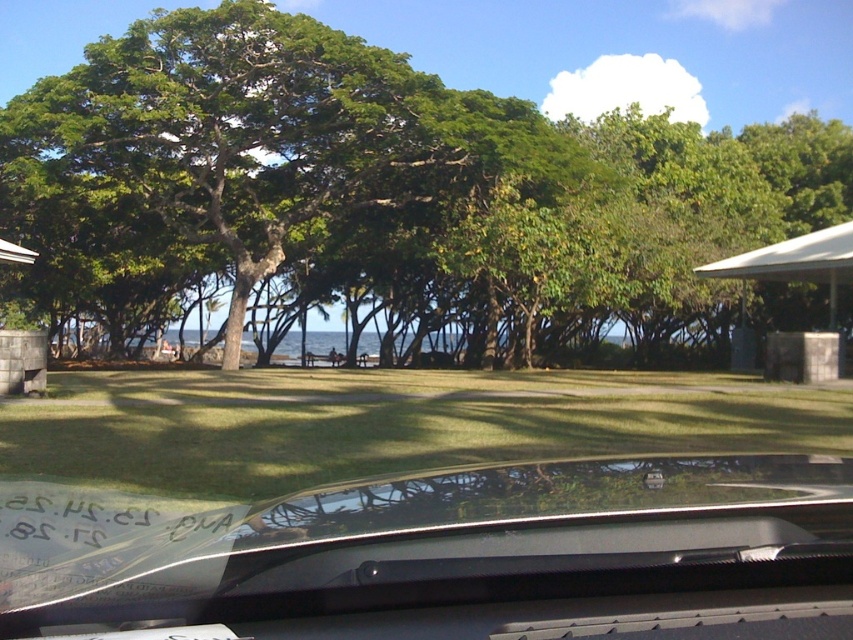
You are sitting in the car and want to look through the windshield to see the grassy area outside. Is the point at coordinate (457, 557) on the windshield or on the grassy area?

The point at coordinate (457, 557) is on the transparent glass windshield at lower center, so it is on the windshield.

You are sitting in the car and looking out through the transparent glass windshield at lower center. Can you see the green grass at center clearly through the windshield?

The transparent glass windshield at lower center is closer to the viewer than green grass at center, so yes, you can see the green grass at center clearly through the transparent glass windshield at lower center because the windshield is transparent and positioned in front of the grass.

You are sitting in the car and want to know how far the green leafy tree at center is from you. Can you determine the distance?

The green leafy tree at center is 67.16 feet away from the viewer.